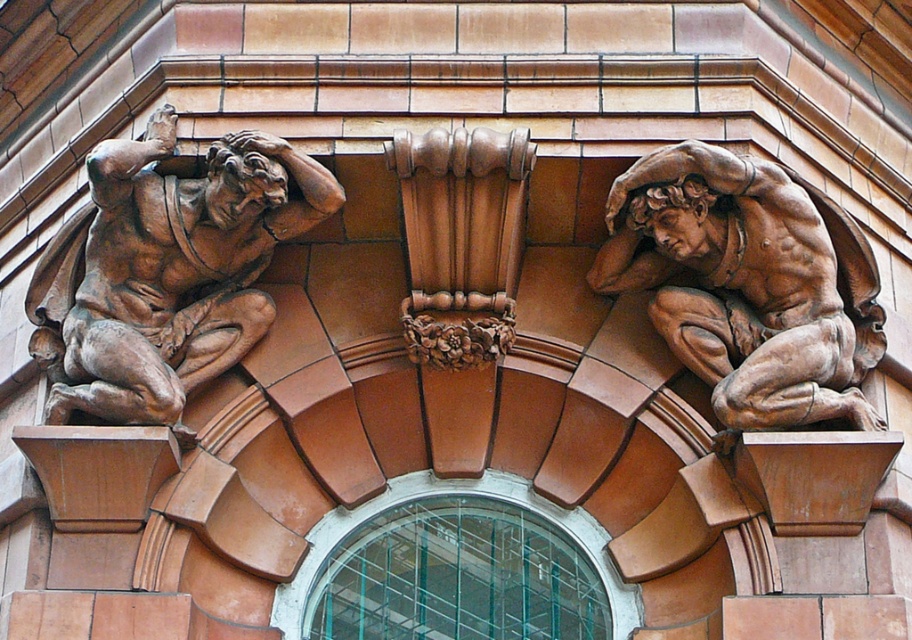
You are an architect examining the building facade and notice the brown polished stone sculpture at upper left and the brown polished stone muscular figure at upper right. Which of these two sculptures is positioned further to the left side of the facade?

The brown polished stone sculpture at upper left is positioned further to the left side of the facade compared to the brown polished stone muscular figure at upper right.

You are an architect reviewing the building facade. You need to ensure that the brown polished stone sculpture at upper left and the brown polished stone muscular figure at upper right are proportionate. Based on their heights, which one should be adjusted to match the other?

The brown polished stone muscular figure at upper right is shorter than the brown polished stone sculpture at upper left. To make them proportionate, the brown polished stone muscular figure at upper right should be made taller to match the height of the brown polished stone sculpture at upper left.